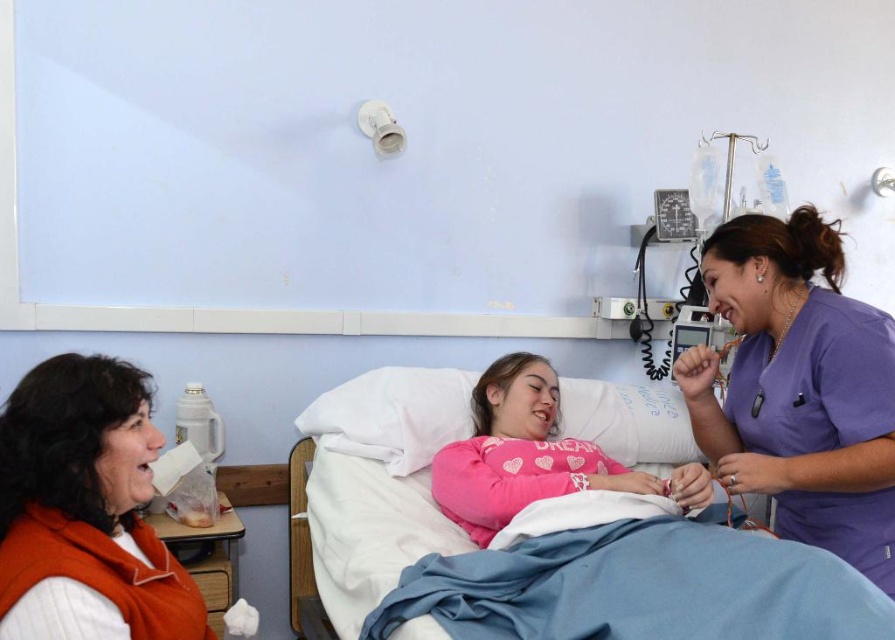
Is orange fleece vest at left below pink cotton pillow at center?

No.

Can you confirm if orange fleece vest at left is positioned to the right of pink cotton pillow at center?

In fact, orange fleece vest at left is to the left of pink cotton pillow at center.

Which is behind, point (73, 440) or point (546, 403)?

The point (546, 403) is more distant.

Find the location of a particular element. The height and width of the screenshot is (640, 895). orange fleece vest at left is located at coordinates [x=86, y=508].

Is white soft pillow at center wider than pink cotton pillow at center?

No.

Who is more distant from viewer, (607, 410) or (550, 410)?

Positioned behind is point (607, 410).

Locate an element on the screen. Image resolution: width=895 pixels, height=640 pixels. white soft pillow at center is located at coordinates (393, 416).

Locate an element on the screen. This screenshot has width=895, height=640. purple scrubs at center is located at coordinates (799, 388).

Can you confirm if purple scrubs at center is bigger than pink cotton pillow at center?

No, purple scrubs at center is not bigger than pink cotton pillow at center.

I want to click on purple scrubs at center, so [x=799, y=388].

Locate an element on the screen. The image size is (895, 640). purple scrubs at center is located at coordinates (799, 388).